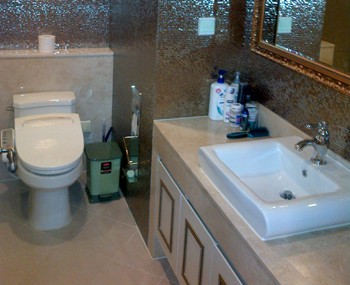
Where is `toilet paper`? The height and width of the screenshot is (285, 350). toilet paper is located at coordinates (50, 45).